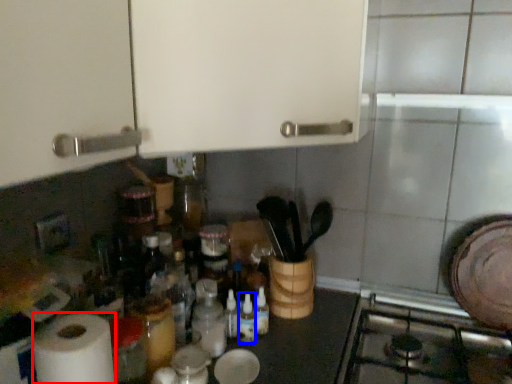
Question: Which object is further to the camera taking this photo, paper towel (highlighted by a red box) or bottle (highlighted by a blue box)?

Choices:
 (A) paper towel
 (B) bottle

Answer: (B)